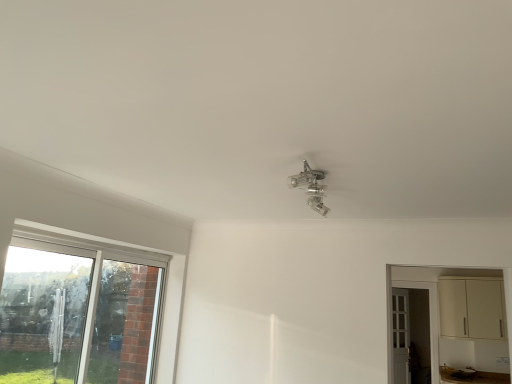
Question: Does cream matte cabinet at right have a lesser height compared to clear plastic umbrella at left?

Choices:
 (A) yes
 (B) no

Answer: (A)

Question: Is cream matte cabinet at right thinner than clear plastic umbrella at left?

Choices:
 (A) no
 (B) yes

Answer: (A)

Question: From the image's perspective, is cream matte cabinet at right below clear plastic umbrella at left?

Choices:
 (A) no
 (B) yes

Answer: (B)

Question: Is cream matte cabinet at right at the right side of clear plastic umbrella at left?

Choices:
 (A) yes
 (B) no

Answer: (A)

Question: Are cream matte cabinet at right and clear plastic umbrella at left far apart?

Choices:
 (A) yes
 (B) no

Answer: (A)

Question: From a real-world perspective, is cream matte cabinet at right on top of clear plastic umbrella at left?

Choices:
 (A) no
 (B) yes

Answer: (B)

Question: Can you confirm if clear glass window at lower left is taller than clear plastic umbrella at left?

Choices:
 (A) no
 (B) yes

Answer: (B)

Question: Is clear glass window at lower left smaller than clear plastic umbrella at left?

Choices:
 (A) no
 (B) yes

Answer: (A)

Question: Does clear glass window at lower left appear on the left side of clear plastic umbrella at left?

Choices:
 (A) no
 (B) yes

Answer: (A)

Question: Does clear glass window at lower left turn towards clear plastic umbrella at left?

Choices:
 (A) yes
 (B) no

Answer: (A)

Question: Considering the relative sizes of clear glass window at lower left and clear plastic umbrella at left in the image provided, is clear glass window at lower left bigger than clear plastic umbrella at left?

Choices:
 (A) yes
 (B) no

Answer: (A)

Question: Is the surface of clear glass window at lower left in direct contact with clear plastic umbrella at left?

Choices:
 (A) yes
 (B) no

Answer: (A)

Question: Is cream matte cabinet at right oriented away from clear glass window at lower left?

Choices:
 (A) yes
 (B) no

Answer: (B)